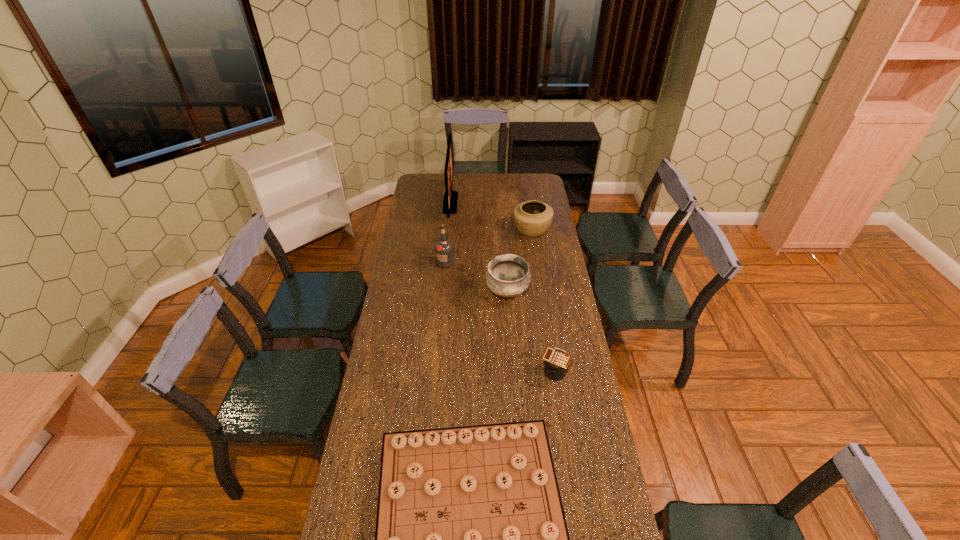
Find the location of a particular element. This screenshot has width=960, height=540. free location that satisfies the following two spatial constraints: 1. on the front-facing side of the second shortest object; 2. on the right side of the tallest object is located at coordinates (435, 370).

Locate an element on the screen. free region that satisfies the following two spatial constraints: 1. on the front label of the nearer pottery; 2. on the right side of the second tallest object is located at coordinates (443, 292).